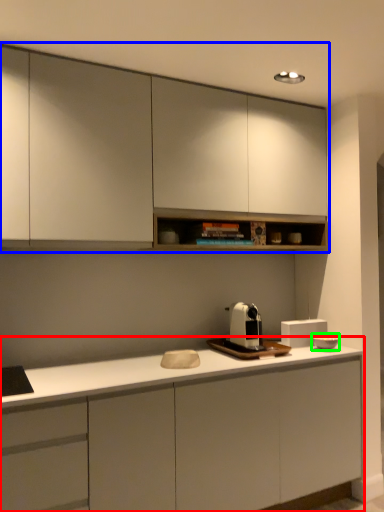
Question: Which object is the closest to the cabinetry (highlighted by a red box)? Choose among these: cabinetry (highlighted by a blue box) or appliance (highlighted by a green box).

Choices:
 (A) cabinetry
 (B) appliance

Answer: (B)